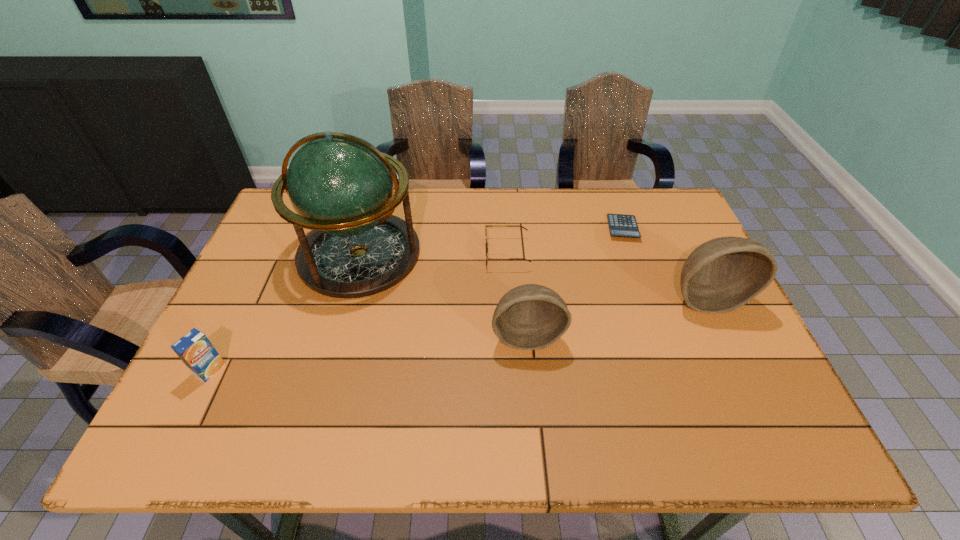
Please point out where to position a new bowl on the left to maintain spacing. Please provide its 2D coordinates. Your answer should be formatted as a tuple, i.e. [(x, y)], where the tuple contains the x and y coordinates of a point satisfying the conditions above.

[(319, 379)]